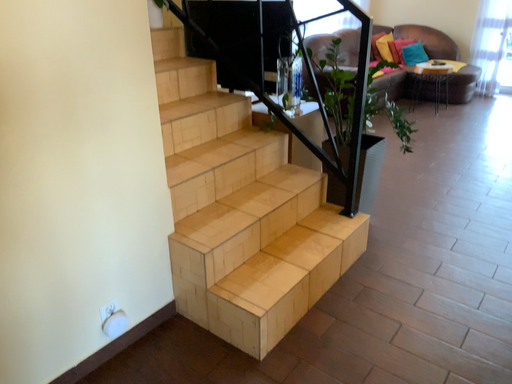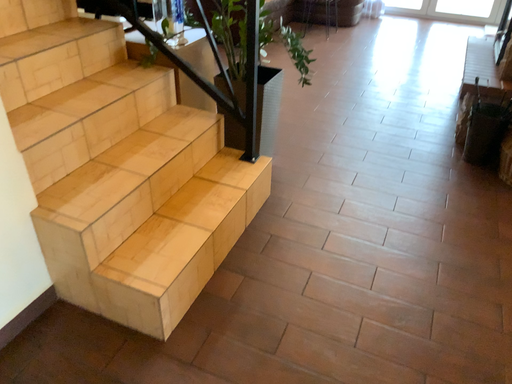
Question: Which way did the camera rotate in the video?

Choices:
 (A) rotated right
 (B) rotated left

Answer: (A)